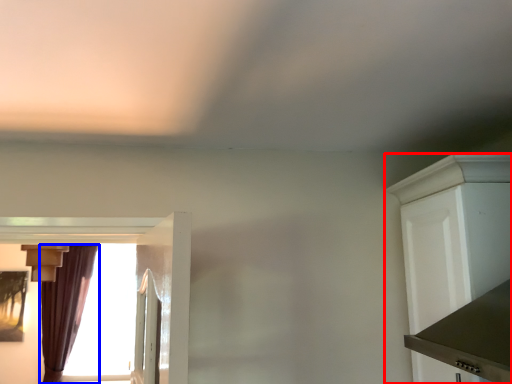
Question: Among these objects, which one is nearest to the camera, cabinetry (highlighted by a red box) or curtain (highlighted by a blue box)?

Choices:
 (A) cabinetry
 (B) curtain

Answer: (A)